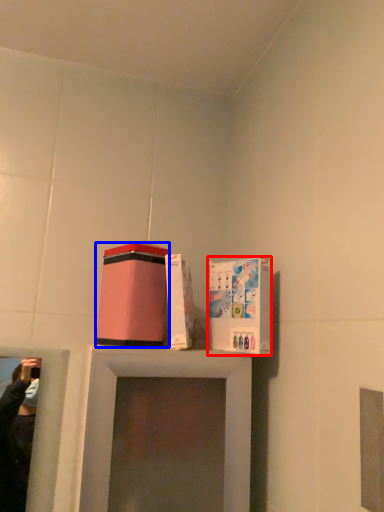
Question: Which object is closer to the camera taking this photo, cardboard box (highlighted by a red box) or box (highlighted by a blue box)?

Choices:
 (A) cardboard box
 (B) box

Answer: (A)